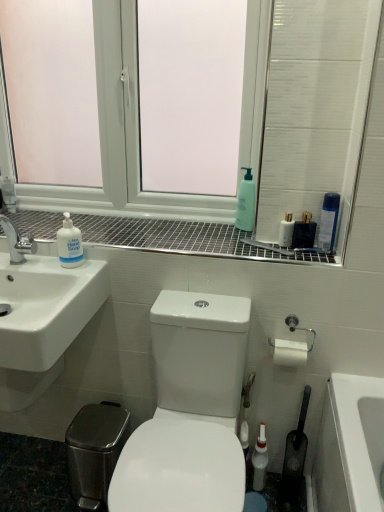
At what (x,y) coordinates should I click in order to perform the action: click on vacant space situated above white glossy sink at upper left (from a real-world perspective). Please return your answer as a coordinate pair (x, y). This screenshot has height=512, width=384. Looking at the image, I should click on (165, 231).